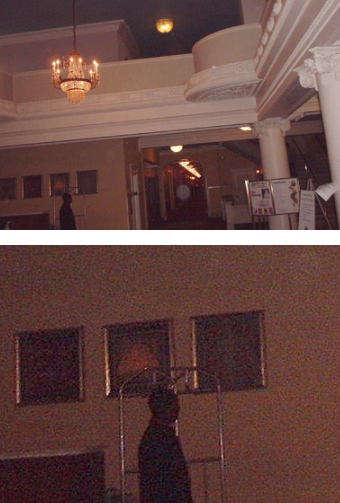
Locate an element on the screen. This screenshot has width=340, height=503. hallway is located at coordinates (193, 181).